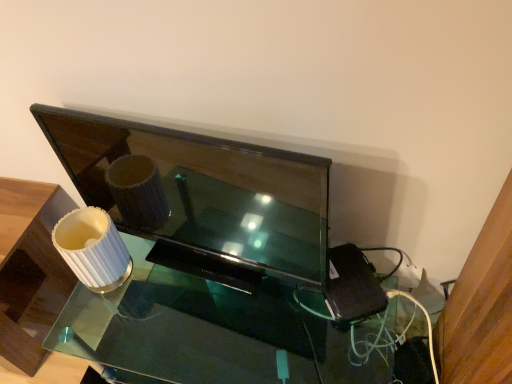
Question: Considering the positions of matte black tv at center and clear glass table at center in the image, is matte black tv at center bigger or smaller than clear glass table at center?

Choices:
 (A) small
 (B) big

Answer: (A)

Question: From their relative heights in the image, would you say matte black tv at center is taller or shorter than clear glass table at center?

Choices:
 (A) tall
 (B) short

Answer: (A)

Question: Estimate the real-world distances between objects in this image. Which object is farther from the clear glass table at center?

Choices:
 (A) white ribbed lampshade at left
 (B) matte black tv at center

Answer: (A)

Question: Which of these objects is positioned closest to the white ribbed lampshade at left?

Choices:
 (A) clear glass table at center
 (B) matte black tv at center

Answer: (A)